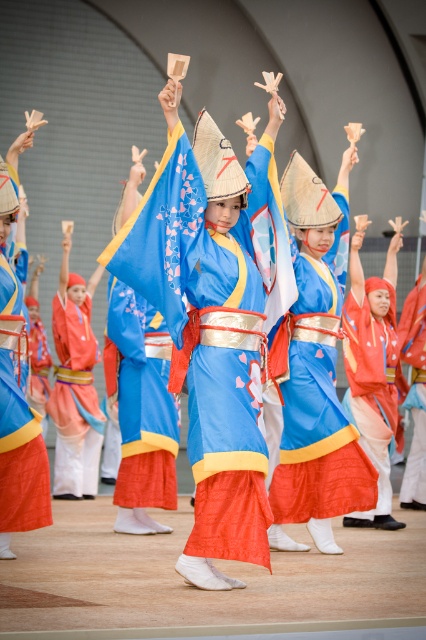
Who is positioned more to the right, blue silk kimono at center or matte red fabric at center?

blue silk kimono at center is more to the right.

Does blue silk kimono at center appear under matte red fabric at center?

Actually, blue silk kimono at center is above matte red fabric at center.

The height and width of the screenshot is (640, 426). What do you see at coordinates (215, 320) in the screenshot?
I see `blue silk kimono at center` at bounding box center [215, 320].

Locate an element on the screen. blue silk kimono at center is located at coordinates (215, 320).

Who is positioned more to the right, matte red fabric kimono at center or silky blue robe at center?

matte red fabric kimono at center is more to the right.

Looking at this image, which is above, matte red fabric kimono at center or silky blue robe at center?

Positioned higher is silky blue robe at center.

At what (x,y) coordinates should I click in order to perform the action: click on matte red fabric kimono at center. Please return your answer as a coordinate pair (x, y). The image size is (426, 640). Looking at the image, I should click on (371, 392).

Based on the photo, who is lower down, matte blue kimono at center or matte red fabric at center?

matte red fabric at center

Is matte blue kimono at center to the right of matte red fabric at center from the viewer's perspective?

Correct, you'll find matte blue kimono at center to the right of matte red fabric at center.

You are a GUI agent. You are given a task and a screenshot of the screen. Output one action in this format:
    pyautogui.click(x=<x>, y=<y>)
    Task: Click on the matte blue kimono at center
    
    Given the screenshot: What is the action you would take?
    pyautogui.click(x=316, y=371)